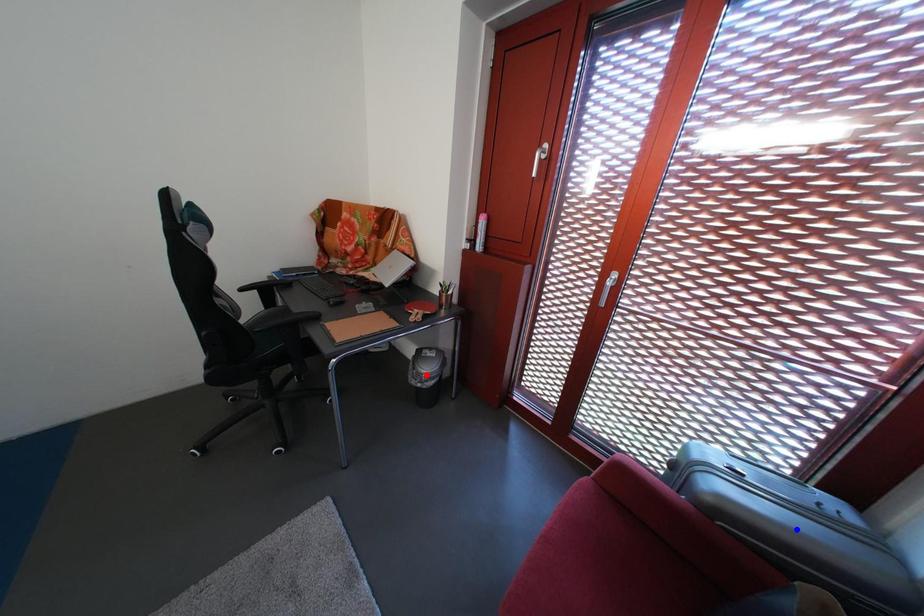
Question: In the image, two points are highlighted. Which point is nearer to the camera? Reply with the corresponding letter.

Choices:
 (A) blue point
 (B) red point

Answer: (A)